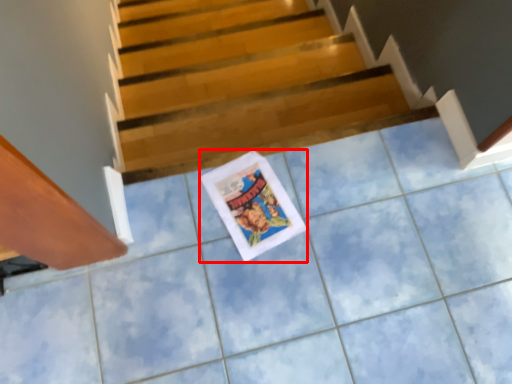
Question: From the image's perspective, where is comic book (annotated by the red box) located relative to stairs?

Choices:
 (A) below
 (B) above

Answer: (A)